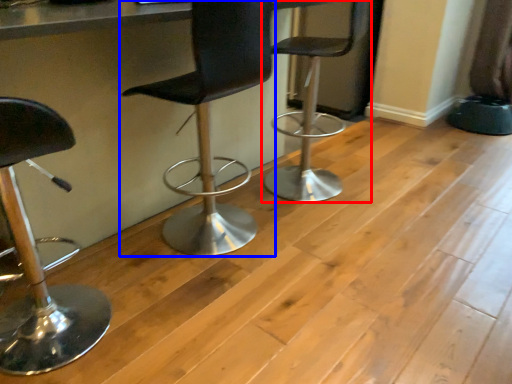
Question: Which of the following is the farthest to the observer, chair (highlighted by a red box) or chair (highlighted by a blue box)?

Choices:
 (A) chair
 (B) chair

Answer: (A)